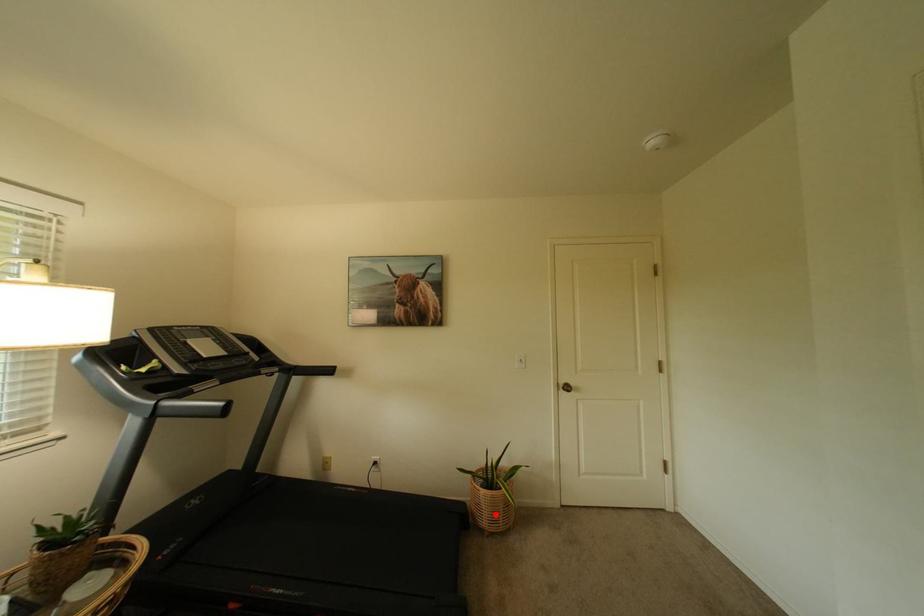
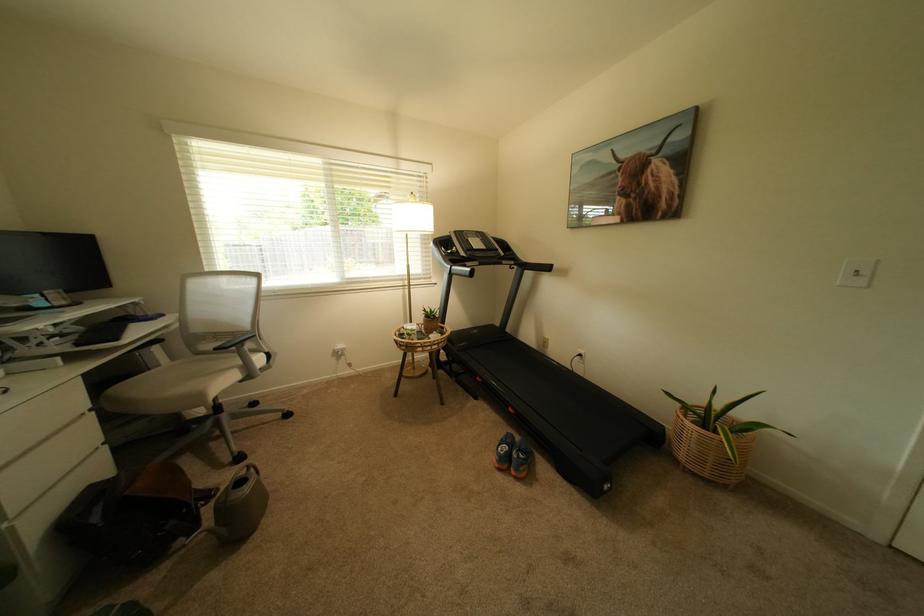
The point at the highlighted location is marked in the first image. Where is the corresponding point in the second image?

(695, 448)